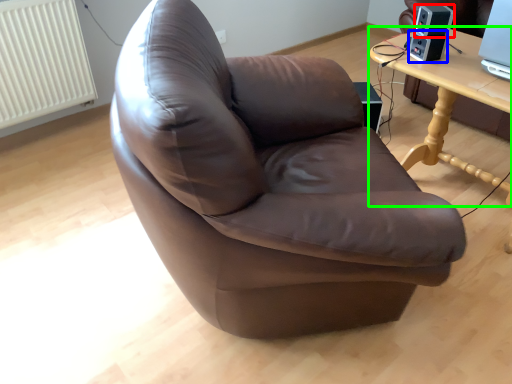
Question: Which object is positioned closest to speaker (highlighted by a red box)? Select from speaker (highlighted by a blue box) and table (highlighted by a green box).

Choices:
 (A) speaker
 (B) table

Answer: (A)